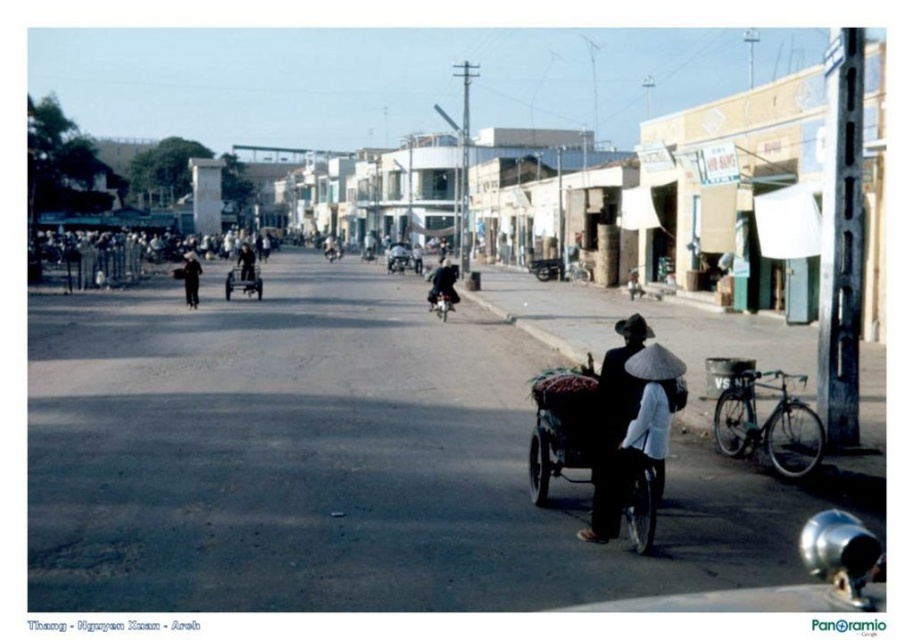
You are a delivery person trying to navigate through the street. You see the black matte conical hat at center and the metallic silver rickshaw at center. Which object is positioned lower from the ground?

The black matte conical hat at center is located below metallic silver rickshaw at center, so it is positioned lower from the ground.

You are standing on the street and want to take a photo that includes both the point at coordinates (277, 81) and the point at coordinates (258, 273). Which point should you focus on first to ensure both are in focus?

You should focus on the point at coordinates (277, 81) first because it is closer to the camera than the point at coordinates (258, 273), ensuring both will be in focus when using depth of field.